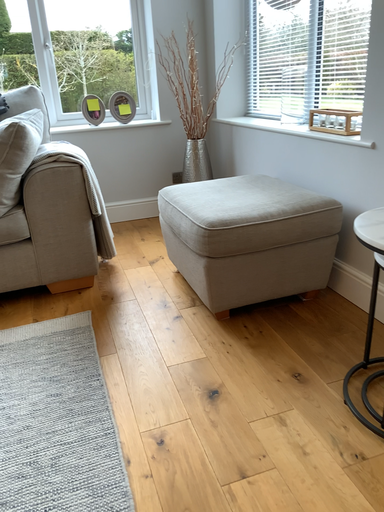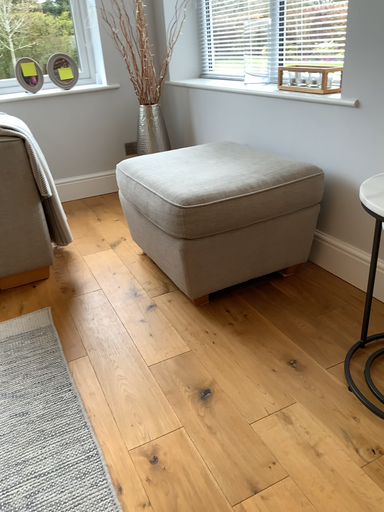
Question: How did the camera likely rotate when shooting the video?

Choices:
 (A) rotated left
 (B) rotated right

Answer: (B)